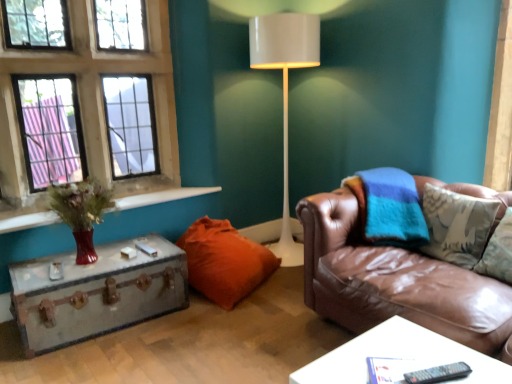
Question: Is white glossy table at lower right, positioned as the second table in left-to-right order, taller than brown leather couch at right?

Choices:
 (A) yes
 (B) no

Answer: (B)

Question: Is brown leather couch at right a part of white glossy table at lower right, positioned as the second table in left-to-right order?

Choices:
 (A) yes
 (B) no

Answer: (B)

Question: From the image's perspective, is white glossy table at lower right, positioned as the first table in front-to-back order, on top of brown leather couch at right?

Choices:
 (A) yes
 (B) no

Answer: (B)

Question: From the image's perspective, is white glossy table at lower right, the 1th table from the right, under brown leather couch at right?

Choices:
 (A) yes
 (B) no

Answer: (A)

Question: Is the position of white glossy table at lower right, arranged as the second table when viewed from the back, more distant than that of brown leather couch at right?

Choices:
 (A) no
 (B) yes

Answer: (A)

Question: Considering the positions of point 261,54 and point 8,160, is point 261,54 closer or farther from the camera than point 8,160?

Choices:
 (A) closer
 (B) farther

Answer: (B)

Question: Relative to glass paneled window at upper left, is white glossy floor lamp at center in front or behind?

Choices:
 (A) behind
 (B) front

Answer: (A)

Question: Considering the positions of white glossy floor lamp at center and glass paneled window at upper left in the image, is white glossy floor lamp at center bigger or smaller than glass paneled window at upper left?

Choices:
 (A) big
 (B) small

Answer: (B)

Question: In terms of height, does white glossy floor lamp at center look taller or shorter compared to glass paneled window at upper left?

Choices:
 (A) tall
 (B) short

Answer: (A)

Question: Is white glossy table at lower right, positioned as the second table in left-to-right order, wider or thinner than metallic suitcase at left, which ranks as the second table in front-to-back order?

Choices:
 (A) wide
 (B) thin

Answer: (B)

Question: Is white glossy table at lower right, the 1th table from the right, in front of or behind metallic suitcase at left, the 1th table in the back-to-front sequence, in the image?

Choices:
 (A) behind
 (B) front

Answer: (B)

Question: Is point (377, 352) positioned closer to the camera than point (84, 286)?

Choices:
 (A) closer
 (B) farther

Answer: (A)

Question: Looking at the image, does white glossy table at lower right, positioned as the second table in left-to-right order, seem bigger or smaller compared to metallic suitcase at left, the 1th table in the back-to-front sequence?

Choices:
 (A) big
 (B) small

Answer: (B)

Question: Considering the positions of point (207, 248) and point (257, 23), is point (207, 248) closer or farther from the camera than point (257, 23)?

Choices:
 (A) closer
 (B) farther

Answer: (A)

Question: From a real-world perspective, relative to white glossy floor lamp at center, is orange fabric pillow at lower center vertically above or below?

Choices:
 (A) above
 (B) below

Answer: (B)